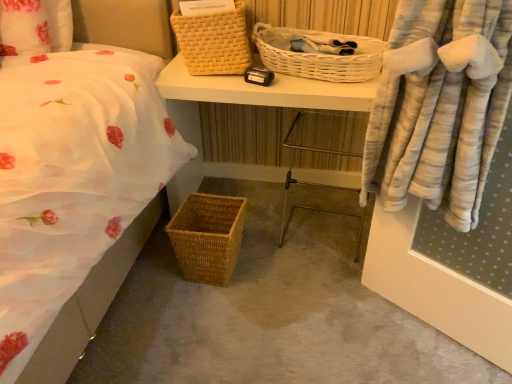
What are the coordinates of `metal frame chair at center` in the screenshot? It's located at (314, 183).

What do you see at coordinates (214, 41) in the screenshot? The width and height of the screenshot is (512, 384). I see `yellow woven picnic basket at upper center, arranged as the first picnic basket when viewed from the top` at bounding box center [214, 41].

Image resolution: width=512 pixels, height=384 pixels. What are the coordinates of `woven wood desk at center` in the screenshot? It's located at (243, 104).

Who is more distant, woven wood desk at center or metal frame chair at center?

woven wood desk at center is further from the camera.

Considering the relative positions of woven wood desk at center and metal frame chair at center in the image provided, is woven wood desk at center to the left of metal frame chair at center from the viewer's perspective?

Yes, woven wood desk at center is to the left of metal frame chair at center.

Is woven wood desk at center thinner than metal frame chair at center?

No.

Can you tell me how much woven wood desk at center and metal frame chair at center differ in facing direction?

They differ by 7.61 degrees in their facing directions.

Is yellow woven picnic basket at upper center, the 3th picnic basket ordered from the bottom, positioned beyond the bounds of woven wood desk at center?

yellow woven picnic basket at upper center, the 3th picnic basket ordered from the bottom, is positioned outside woven wood desk at center.

Who is smaller, yellow woven picnic basket at upper center, the 3th picnic basket ordered from the bottom, or woven wood desk at center?

yellow woven picnic basket at upper center, the 3th picnic basket ordered from the bottom.

Looking at this image, considering the sizes of objects yellow woven picnic basket at upper center, the 3th picnic basket ordered from the bottom, and woven wood desk at center in the image provided, who is wider, yellow woven picnic basket at upper center, the 3th picnic basket ordered from the bottom, or woven wood desk at center?

Wider between the two is woven wood desk at center.

Is yellow woven picnic basket at upper center, the 3th picnic basket ordered from the bottom, shorter than woven wood desk at center?

Indeed, yellow woven picnic basket at upper center, the 3th picnic basket ordered from the bottom, has a lesser height compared to woven wood desk at center.

Visually, is white wicker picnic basket at upper center, the 2th picnic basket from the top, positioned to the left or to the right of woven wood desk at center?

In the image, white wicker picnic basket at upper center, the 2th picnic basket from the top, appears on the right side of woven wood desk at center.

From a real-world perspective, who is located higher, white wicker picnic basket at upper center, the 2th picnic basket from the top, or woven wood desk at center?

white wicker picnic basket at upper center, the 2th picnic basket from the top, from a real-world perspective.

Would you consider white wicker picnic basket at upper center, the 2th picnic basket from the top, to be distant from woven wood desk at center?

No, white wicker picnic basket at upper center, the 2th picnic basket from the top, is not far from woven wood desk at center.

Which object is closer to the camera, white wicker picnic basket at upper center, the 2th picnic basket ordered from the bottom, or yellow woven picnic basket at upper center, the 3th picnic basket ordered from the bottom?

white wicker picnic basket at upper center, the 2th picnic basket ordered from the bottom.

Is white wicker picnic basket at upper center, the 2th picnic basket ordered from the bottom, taller than yellow woven picnic basket at upper center, the 3th picnic basket ordered from the bottom?

No, white wicker picnic basket at upper center, the 2th picnic basket ordered from the bottom, is not taller than yellow woven picnic basket at upper center, the 3th picnic basket ordered from the bottom.

From the image's perspective, would you say white wicker picnic basket at upper center, the 2th picnic basket from the top, is positioned over yellow woven picnic basket at upper center, the 3th picnic basket ordered from the bottom?

No, from the image's perspective, white wicker picnic basket at upper center, the 2th picnic basket from the top, is not over yellow woven picnic basket at upper center, the 3th picnic basket ordered from the bottom.

Considering the relative sizes of white wicker picnic basket at upper center, the 2th picnic basket from the top, and yellow woven picnic basket at upper center, the 3th picnic basket ordered from the bottom, in the image provided, is white wicker picnic basket at upper center, the 2th picnic basket from the top, wider than yellow woven picnic basket at upper center, the 3th picnic basket ordered from the bottom,?

Indeed, white wicker picnic basket at upper center, the 2th picnic basket from the top, has a greater width compared to yellow woven picnic basket at upper center, the 3th picnic basket ordered from the bottom.

How many degrees apart are the facing directions of woven wood desk at center and white wicker picnic basket at upper center, the 2th picnic basket from the top?

They differ by 0.00122 degrees in their facing directions.

Which is more to the left, woven wood desk at center or white wicker picnic basket at upper center, the 2th picnic basket from the top?

From the viewer's perspective, woven wood desk at center appears more on the left side.

Is woven wood desk at center next to white wicker picnic basket at upper center, the 2th picnic basket ordered from the bottom?

woven wood desk at center and white wicker picnic basket at upper center, the 2th picnic basket ordered from the bottom, are not in contact.

Is woven wood desk at center wider than white wicker picnic basket at upper center, the 2th picnic basket ordered from the bottom?

Indeed, woven wood desk at center has a greater width compared to white wicker picnic basket at upper center, the 2th picnic basket ordered from the bottom.

Considering the points (180, 68) and (208, 265), which point is in front, point (180, 68) or point (208, 265)?

The point (208, 265) is closer to the camera.

Consider the image. How many degrees apart are the facing directions of woven wood desk at center and woven brown picnic basket at lower left, which ranks as the third picnic basket in top-to-bottom order?

woven wood desk at center and woven brown picnic basket at lower left, which ranks as the third picnic basket in top-to-bottom order, are facing 2.78 degrees away from each other.

Is the depth of woven wood desk at center less than that of woven brown picnic basket at lower left, the first picnic basket positioned from the bottom?

No, woven wood desk at center is further to the viewer.

Is woven wood desk at center thinner than yellow woven picnic basket at upper center, the 3th picnic basket ordered from the bottom?

No.

From a real-world perspective, does woven wood desk at center sit lower than yellow woven picnic basket at upper center, the 3th picnic basket ordered from the bottom?

Yes, from a real-world perspective, woven wood desk at center is under yellow woven picnic basket at upper center, the 3th picnic basket ordered from the bottom.

Is point (319, 98) in front of point (222, 26)?

Yes.

Is woven wood desk at center smaller than yellow woven picnic basket at upper center, arranged as the first picnic basket when viewed from the top?

Actually, woven wood desk at center might be larger than yellow woven picnic basket at upper center, arranged as the first picnic basket when viewed from the top.

Locate an element on the screen. The height and width of the screenshot is (384, 512). chair below the woven wood desk at center (from a real-world perspective) is located at coordinates (314, 183).

At what (x,y) coordinates should I click in order to perform the action: click on desk that is in front of the yellow woven picnic basket at upper center, the 3th picnic basket ordered from the bottom. Please return your answer as a coordinate pair (x, y). Image resolution: width=512 pixels, height=384 pixels. Looking at the image, I should click on (243, 104).

Estimate the real-world distances between objects in this image. Which object is closer to yellow woven picnic basket at upper center, the 3th picnic basket ordered from the bottom, white wicker picnic basket at upper center, the 2th picnic basket ordered from the bottom, or woven brown picnic basket at lower left, the first picnic basket positioned from the bottom?

white wicker picnic basket at upper center, the 2th picnic basket ordered from the bottom, lies closer to yellow woven picnic basket at upper center, the 3th picnic basket ordered from the bottom, than the other object.

Which object lies nearer to the anchor point white wicker picnic basket at upper center, the 2th picnic basket ordered from the bottom, woven wood desk at center or woven brown picnic basket at lower left, the first picnic basket positioned from the bottom?

woven wood desk at center.

From the image, which object appears to be farther from woven wood desk at center, woven brown picnic basket at lower left, which ranks as the third picnic basket in top-to-bottom order, or white wicker picnic basket at upper center, the 2th picnic basket from the top?

woven brown picnic basket at lower left, which ranks as the third picnic basket in top-to-bottom order.

Estimate the real-world distances between objects in this image. Which object is further from white wicker picnic basket at upper center, the 2th picnic basket from the top, yellow woven picnic basket at upper center, the 3th picnic basket ordered from the bottom, or metal frame chair at center?

metal frame chair at center.

Which object lies further to the anchor point white wicker picnic basket at upper center, the 2th picnic basket ordered from the bottom, woven brown picnic basket at lower left, the first picnic basket positioned from the bottom, or metal frame chair at center?

woven brown picnic basket at lower left, the first picnic basket positioned from the bottom, is further to white wicker picnic basket at upper center, the 2th picnic basket ordered from the bottom.

Estimate the real-world distances between objects in this image. Which object is further from white wicker picnic basket at upper center, the 2th picnic basket ordered from the bottom, metal frame chair at center or yellow woven picnic basket at upper center, arranged as the first picnic basket when viewed from the top?

metal frame chair at center.

Considering their positions, is white wicker picnic basket at upper center, the 2th picnic basket from the top, positioned closer to yellow woven picnic basket at upper center, arranged as the first picnic basket when viewed from the top, than metal frame chair at center?

The object closer to yellow woven picnic basket at upper center, arranged as the first picnic basket when viewed from the top, is white wicker picnic basket at upper center, the 2th picnic basket from the top.

Estimate the real-world distances between objects in this image. Which object is closer to yellow woven picnic basket at upper center, arranged as the first picnic basket when viewed from the top, woven wood desk at center or metal frame chair at center?

Among the two, woven wood desk at center is located nearer to yellow woven picnic basket at upper center, arranged as the first picnic basket when viewed from the top.

Find the location of a particular element. This screenshot has width=512, height=384. desk between white wicker picnic basket at upper center, the 2th picnic basket from the top, and metal frame chair at center in the up-down direction is located at coordinates (243, 104).

Identify the location of chair between yellow woven picnic basket at upper center, arranged as the first picnic basket when viewed from the top, and woven brown picnic basket at lower left, the first picnic basket positioned from the bottom, in the vertical direction. The image size is (512, 384). 314,183.

What are the coordinates of `desk between yellow woven picnic basket at upper center, the 3th picnic basket ordered from the bottom, and metal frame chair at center, in the vertical direction` in the screenshot? It's located at (243, 104).

Image resolution: width=512 pixels, height=384 pixels. In order to click on desk between woven brown picnic basket at lower left, which ranks as the third picnic basket in top-to-bottom order, and metal frame chair at center in this screenshot , I will do `click(243, 104)`.